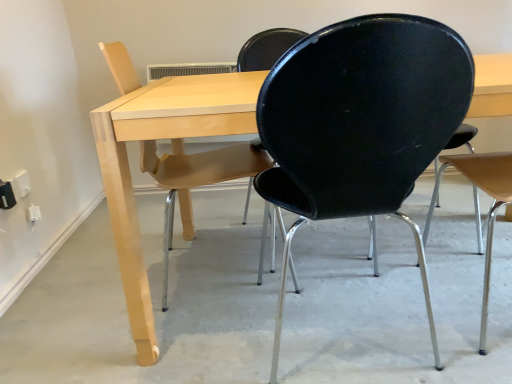
Find the location of `free space between black matte chair at right, acting as the 3th chair starting from the left, and black plastic chair at center, which ranks as the second chair in left-to-right order`. free space between black matte chair at right, acting as the 3th chair starting from the left, and black plastic chair at center, which ranks as the second chair in left-to-right order is located at coordinates (420, 314).